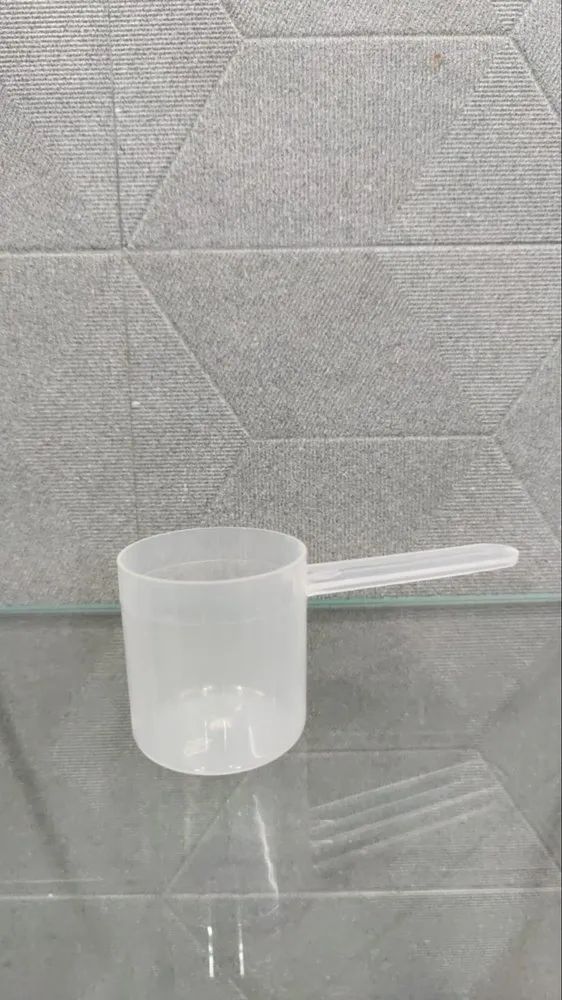
Where is `green edge of backsplash`? The width and height of the screenshot is (562, 1000). green edge of backsplash is located at coordinates (459, 602), (93, 610).